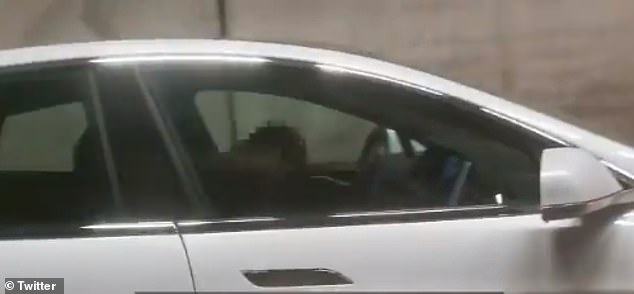
At what (x,y) coordinates should I click in order to perform the action: click on back right window. Please return your answer as a coordinate pair (x, y). This screenshot has height=294, width=634. Looking at the image, I should click on pos(53,143).